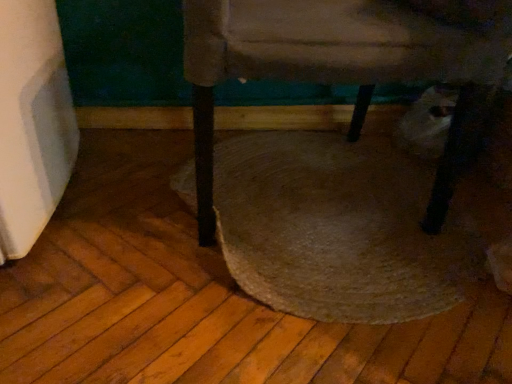
In order to face velvet beige chair at center, should I rotate leftwards or rightwards?

Turn right by 7.755 degrees to look at velvet beige chair at center.

Where is `velvet beige chair at center`? velvet beige chair at center is located at coordinates (345, 64).

Measure the distance between point [243,37] and camera.

Point [243,37] and camera are 27.83 inches apart from each other.

The height and width of the screenshot is (384, 512). What do you see at coordinates (345, 64) in the screenshot? I see `velvet beige chair at center` at bounding box center [345, 64].

In order to face rug at center, should I rotate leftwards or rightwards?

A 10.188 degree turn to the right will do.

The height and width of the screenshot is (384, 512). What do you see at coordinates (337, 229) in the screenshot? I see `rug at center` at bounding box center [337, 229].

Identify the location of rug at center. This screenshot has width=512, height=384. (337, 229).

What is the approximate width of rug at center?

rug at center is 28.04 inches wide.

What are the coordinates of `velvet beige chair at center` in the screenshot? It's located at (345, 64).

Looking at this image, between rug at center and velvet beige chair at center, which one appears on the left side from the viewer's perspective?

velvet beige chair at center is more to the left.

Which object is closer to the camera, rug at center or velvet beige chair at center?

Positioned in front is velvet beige chair at center.

Is point (378, 248) closer to viewer compared to point (424, 35)?

No, (378, 248) is further to viewer.

From the image's perspective, is rug at center beneath velvet beige chair at center?

Correct, rug at center appears lower than velvet beige chair at center in the image.

In the scene shown: From a real-world perspective, is rug at center physically below velvet beige chair at center?

Yes.

Does rug at center have a greater width compared to velvet beige chair at center?

Yes.

Between rug at center and velvet beige chair at center, which one has less height?

With less height is rug at center.

Is rug at center smaller than velvet beige chair at center?

Yes.

Is rug at center spatially inside velvet beige chair at center, or outside of it?

rug at center is contained in velvet beige chair at center.

Are rug at center and velvet beige chair at center making contact?

They are not placed beside each other.

Is rug at center oriented away from velvet beige chair at center?

Absolutely, rug at center is directed away from velvet beige chair at center.

How much distance is there between rug at center and velvet beige chair at center?

The distance of rug at center from velvet beige chair at center is 12.85 inches.

In order to click on mat on the right side of velvet beige chair at center in this screenshot , I will do `click(337, 229)`.

Is velvet beige chair at center to the right of rug at center from the viewer's perspective?

No, velvet beige chair at center is not to the right of rug at center.

Which is behind, velvet beige chair at center or rug at center?

rug at center is further away from the camera.

Is point (270, 62) positioned before point (314, 154)?

Yes, point (270, 62) is in front of point (314, 154).

From the image's perspective, is velvet beige chair at center positioned above or below rug at center?

Clearly, from the image's perspective, velvet beige chair at center is above rug at center.

From a real-world perspective, who is located higher, velvet beige chair at center or rug at center?

In real-world perspective, velvet beige chair at center is above.

Considering the sizes of objects velvet beige chair at center and rug at center in the image provided, who is thinner, velvet beige chair at center or rug at center?

Thinner between the two is velvet beige chair at center.

Can you confirm if velvet beige chair at center is shorter than rug at center?

In fact, velvet beige chair at center may be taller than rug at center.

Looking at this image, considering the sizes of objects velvet beige chair at center and rug at center in the image provided, who is smaller, velvet beige chair at center or rug at center?

Smaller between the two is rug at center.

Choose the correct answer: Is velvet beige chair at center inside rug at center or outside it?

velvet beige chair at center is not enclosed by rug at center.

Is there a large distance between velvet beige chair at center and rug at center?

Actually, velvet beige chair at center and rug at center are a little close together.

Does velvet beige chair at center turn towards rug at center?

No, velvet beige chair at center is not aimed at rug at center.

This screenshot has width=512, height=384. I want to click on chair that is on the left side of rug at center, so [345, 64].

The image size is (512, 384). In order to click on mat below the velvet beige chair at center (from a real-world perspective) in this screenshot , I will do `click(337, 229)`.

Image resolution: width=512 pixels, height=384 pixels. I want to click on mat to the right of velvet beige chair at center, so click(337, 229).